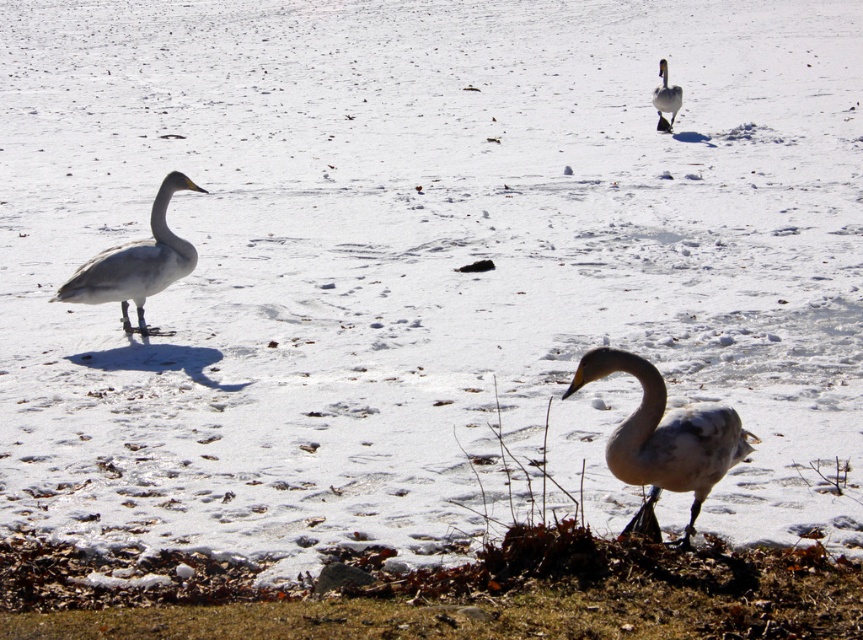
Question: Estimate the real-world distances between objects in this image. Which object is farther from the white matte goose at lower center?

Choices:
 (A) white matte goose at left
 (B) white matte duck at upper center

Answer: (B)

Question: Which point is closer to the camera?

Choices:
 (A) white matte goose at left
 (B) white matte duck at upper center

Answer: (A)

Question: Is white matte goose at lower center wider than white matte duck at upper center?

Choices:
 (A) yes
 (B) no

Answer: (A)

Question: Which point is closer to the camera?

Choices:
 (A) (668, 467)
 (B) (669, 112)

Answer: (A)

Question: Where is white matte goose at lower center located in relation to white matte goose at left in the image?

Choices:
 (A) below
 (B) above

Answer: (A)

Question: Can you confirm if white matte goose at lower center is smaller than white matte goose at left?

Choices:
 (A) no
 (B) yes

Answer: (B)